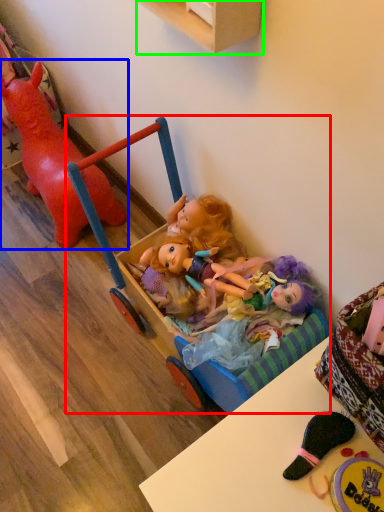
Question: Which object is the closest to the baby carriage (highlighted by a red box)? Choose among these: toy (highlighted by a blue box) or cabinetry (highlighted by a green box).

Choices:
 (A) toy
 (B) cabinetry

Answer: (A)